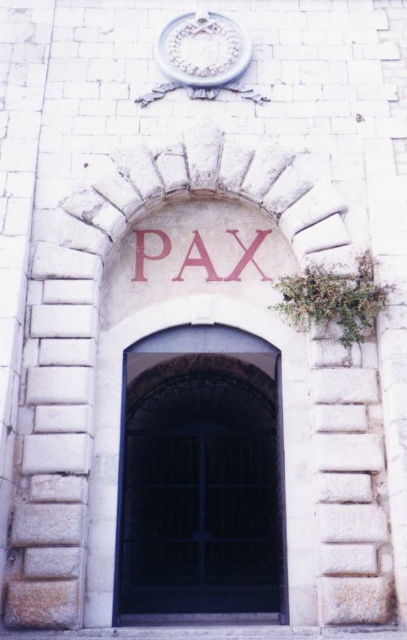
Is black metal gate at center below red stone lettering at center?

Correct, black metal gate at center is located below red stone lettering at center.

Which is above, black metal gate at center or red stone lettering at center?

red stone lettering at center is higher up.

Between point (188, 378) and point (256, 250), which one is positioned behind?

The point (188, 378) is more distant.

The width and height of the screenshot is (407, 640). I want to click on black metal gate at center, so click(x=201, y=476).

Between white stone clock at upper center and red stone lettering at center, which one appears on the right side from the viewer's perspective?

Positioned to the right is red stone lettering at center.

Can you confirm if white stone clock at upper center is thinner than red stone lettering at center?

No.

In order to click on white stone clock at upper center in this screenshot , I will do `click(203, 51)`.

From the picture: Which is more to the right, black metal gate at center or white stone clock at upper center?

black metal gate at center is more to the right.

Is black metal gate at center bigger than white stone clock at upper center?

Actually, black metal gate at center might be smaller than white stone clock at upper center.

Which is behind, point (148, 458) or point (232, 20)?

The point (148, 458) is behind.

I want to click on black metal gate at center, so click(x=201, y=476).